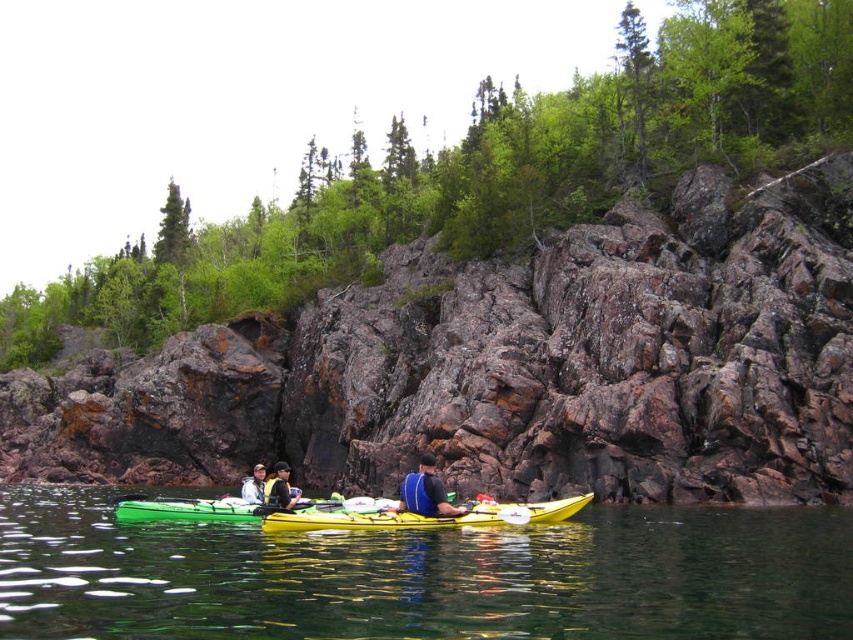
Question: Is rusty rock cliff at center positioned in front of green rubber kayak at lower center?

Choices:
 (A) yes
 (B) no

Answer: (B)

Question: Estimate the real-world distances between objects in this image. Which object is closer to the black fabric shirt at lower center?

Choices:
 (A) light gray fabric jacket at lower left
 (B) blue fabric life vest at center
 (C) green rubber kayak at lower center

Answer: (A)

Question: Does blue fabric life vest at center have a larger size compared to black fabric shirt at lower center?

Choices:
 (A) yes
 (B) no

Answer: (B)

Question: Considering the real-world distances, which object is farthest from the rusty rock cliff at center?

Choices:
 (A) yellow plastic kayak at center
 (B) green rubber kayak at lower center
 (C) blue fabric life vest at center
 (D) light gray fabric jacket at lower left

Answer: (A)

Question: Which of the following is the closest to the observer?

Choices:
 (A) (263, 499)
 (B) (363, 634)
 (C) (280, 502)
 (D) (712, 467)

Answer: (B)

Question: Is black fabric shirt at lower center to the right of light gray fabric jacket at lower left from the viewer's perspective?

Choices:
 (A) yes
 (B) no

Answer: (A)